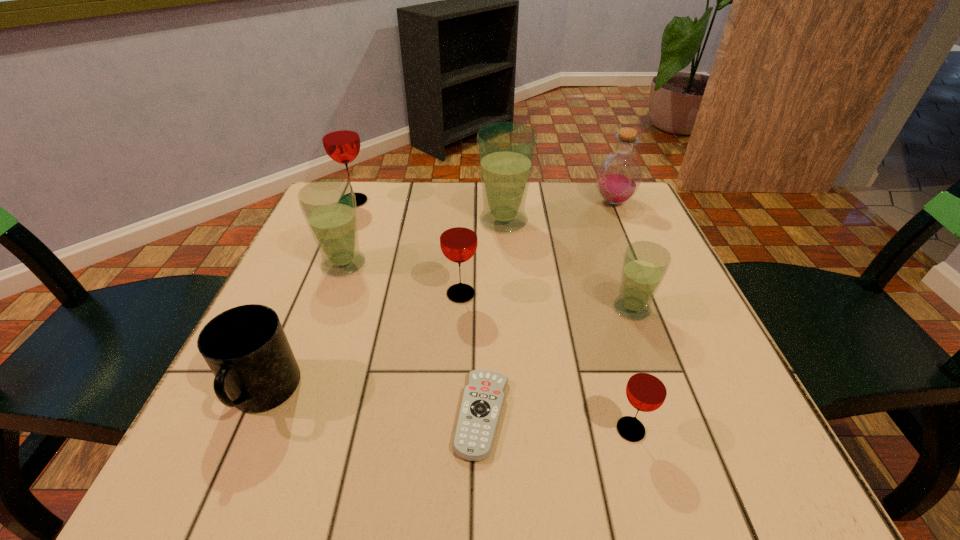
This screenshot has width=960, height=540. I want to click on vacant area situated on the right of the rightmost glass, so click(x=678, y=309).

The image size is (960, 540). Identify the location of blank space located 0.330m on the back of the nearest glass. (588, 275).

Where is `free point located on the side of the black mug with the handle`? The height and width of the screenshot is (540, 960). free point located on the side of the black mug with the handle is located at coordinates (225, 484).

This screenshot has width=960, height=540. Find the location of `vacant space located on the back of the shortest object`. vacant space located on the back of the shortest object is located at coordinates (482, 310).

Where is `bottle that is at the far edge`? bottle that is at the far edge is located at coordinates (619, 175).

Identify the location of glass that is at the near edge. (646, 390).

Locate an element on the screen. This screenshot has height=540, width=960. mug located in the near edge section of the desktop is located at coordinates (246, 348).

This screenshot has width=960, height=540. Identify the location of remote control at the near edge. (483, 398).

The height and width of the screenshot is (540, 960). What are the coordinates of `mug located at the left edge` in the screenshot? It's located at (246, 348).

This screenshot has width=960, height=540. I want to click on bottle located in the right edge section of the desktop, so pyautogui.click(x=619, y=175).